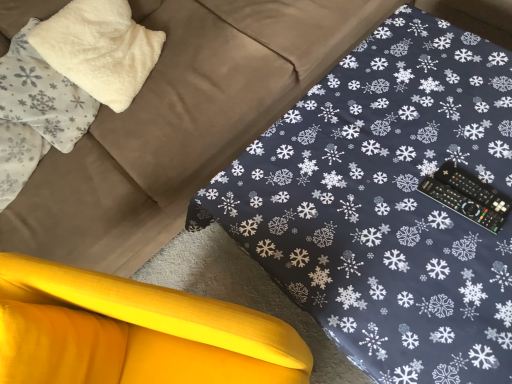
Where is `unoccupied area behind black plastic remote at right`? The image size is (512, 384). unoccupied area behind black plastic remote at right is located at coordinates (416, 156).